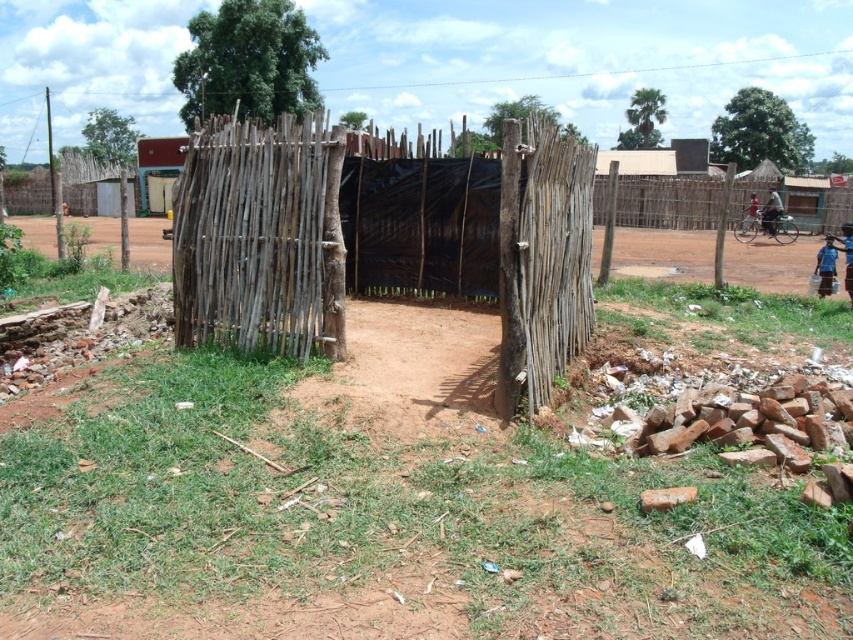
Question: Which object is closer to the camera taking this photo?

Choices:
 (A) natural wood fence at center
 (B) blue fabric child at lower right

Answer: (A)

Question: Can you confirm if natural wood fence at center is thinner than blue fabric child at lower right?

Choices:
 (A) yes
 (B) no

Answer: (B)

Question: Is natural wood fence at center positioned behind blue fabric child at lower right?

Choices:
 (A) no
 (B) yes

Answer: (A)

Question: Can you confirm if natural wood fence at center is positioned above blue fabric child at lower right?

Choices:
 (A) yes
 (B) no

Answer: (A)

Question: Which point is farther to the camera?

Choices:
 (A) blue fabric child at lower right
 (B) natural wood fence at center

Answer: (A)